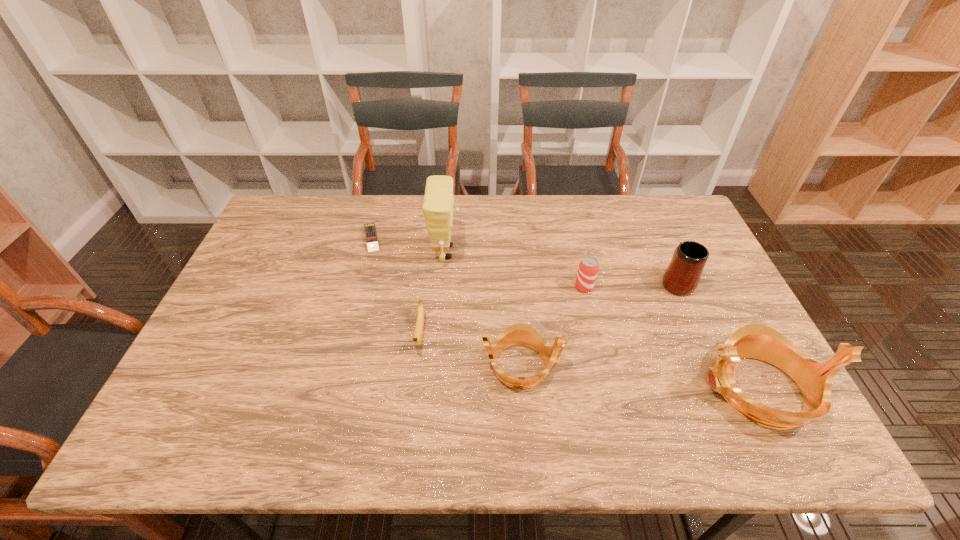
You are a GUI agent. You are given a task and a screenshot of the screen. Output one action in this format:
    pyautogui.click(x=<x>, y=<y>)
    Task: Click on the free space located 0.180m at the front emblem of the shorter tiara
    The image size is (960, 540).
    Given the screenshot: What is the action you would take?
    pyautogui.click(x=635, y=365)

This screenshot has width=960, height=540. I want to click on free space located at the front emblem of the taller tiara, so click(640, 389).

Where is `free space located at the front emblem of the taller tiara`? This screenshot has height=540, width=960. free space located at the front emblem of the taller tiara is located at coordinates (561, 389).

Identify the location of free spot located 0.070m at the front emblem of the taller tiara. Image resolution: width=960 pixels, height=540 pixels. (666, 389).

At what (x,y) coordinates should I click in order to perform the action: click on vacant position located on the side of the mug with the handle. Please return your answer as a coordinate pair (x, y). The height and width of the screenshot is (540, 960). Looking at the image, I should click on (639, 198).

This screenshot has height=540, width=960. What are the coordinates of `vacant space located 0.260m on the side of the mug with the handle` in the screenshot? It's located at (647, 215).

The width and height of the screenshot is (960, 540). What are the coordinates of `vacant space situated on the side of the mug with the handle` in the screenshot? It's located at (658, 239).

Locate an element on the screen. free space located 0.210m on the left of the shortest object is located at coordinates (297, 237).

You are a GUI agent. You are given a task and a screenshot of the screen. Output one action in this format:
    pyautogui.click(x=<x>, y=<y>)
    Task: Click on the free region located 0.270m on the face of the tallest object
    
    Given the screenshot: What is the action you would take?
    point(546,252)

The image size is (960, 540). I want to click on blank space located 0.390m on the back of the third object from right to left, so click(564, 203).